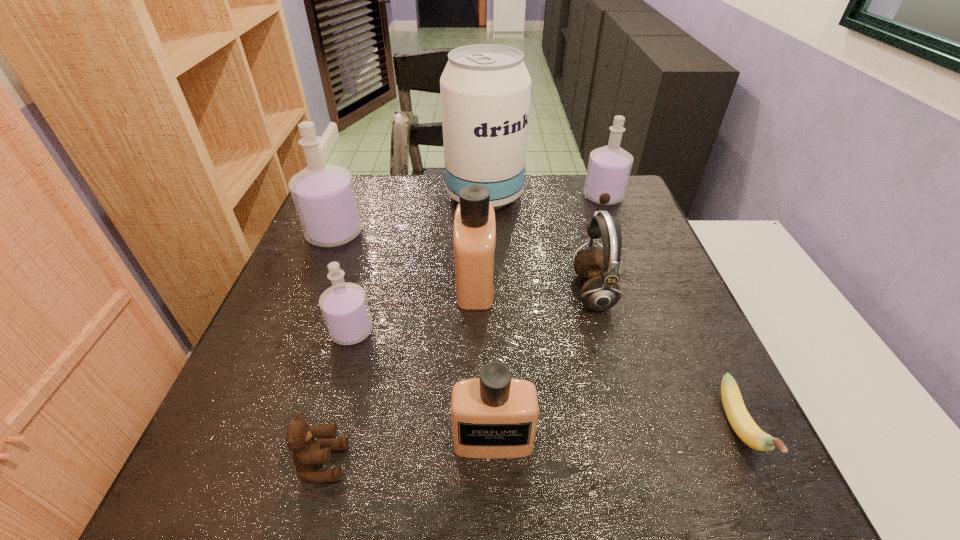
Image resolution: width=960 pixels, height=540 pixels. Identify the location of the nearest purple perfume. (344, 306).

The height and width of the screenshot is (540, 960). Identify the location of the smaller beige perfume. (495, 416).

Where is `the nearer beige perfume`? the nearer beige perfume is located at coordinates (495, 416).

Identify the location of the eighth tallest object. Image resolution: width=960 pixels, height=540 pixels. (307, 453).

The height and width of the screenshot is (540, 960). What are the coordinates of `the shortest object` in the screenshot? It's located at (740, 420).

I want to click on yellow banana, so click(740, 420).

You are a GUI agent. You are given a task and a screenshot of the screen. Output one action in this format:
    pyautogui.click(x=<x>, y=<y>)
    Task: Click on the vacant space situated on the left of the tallest object
    This screenshot has height=540, width=960.
    Given the screenshot: What is the action you would take?
    pyautogui.click(x=429, y=196)

At what (x,y) coordinates should I click in order to perform the action: click on blank space located on the front of the leftmost perfume. Please return your answer as a coordinate pair (x, y). Looking at the image, I should click on pyautogui.click(x=286, y=353).

Where is `vacant space located on the front of the farthest perfume`? The height and width of the screenshot is (540, 960). vacant space located on the front of the farthest perfume is located at coordinates [633, 273].

I want to click on vacant space located 0.300m on the front label of the bigger beige perfume, so click(x=625, y=283).